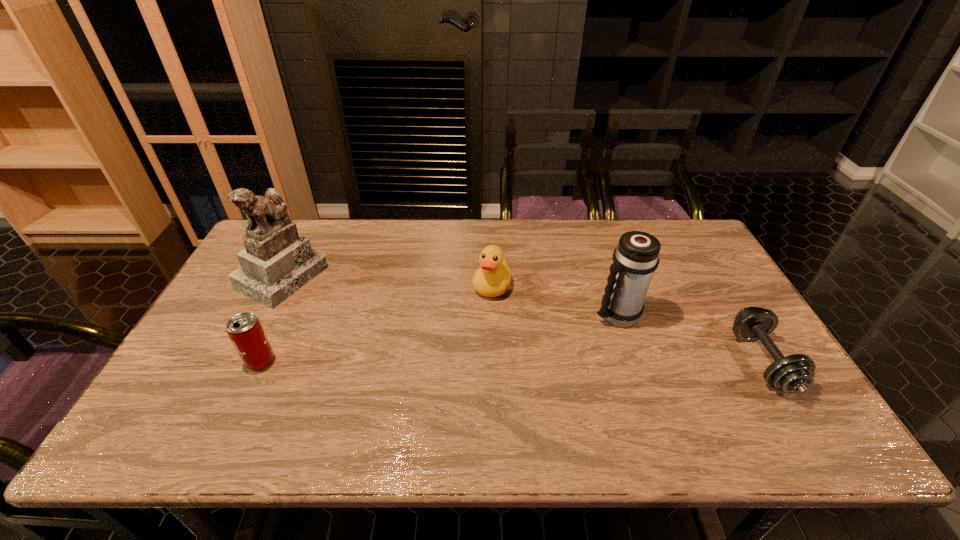
Identify the location of vacant space on the desktop that is between the beer can and the dumbbell and is positioned on the side with the handle of the fourth object from left to right. (559, 361).

Where is `vacant space on the desktop that is between the beer can and the dumbbell and is positioned on the front-facing side of the figurine`? The width and height of the screenshot is (960, 540). vacant space on the desktop that is between the beer can and the dumbbell and is positioned on the front-facing side of the figurine is located at coordinates (460, 361).

You are a GUI agent. You are given a task and a screenshot of the screen. Output one action in this format:
    pyautogui.click(x=<x>, y=<y>)
    Task: Click on the vacant spot on the desktop that is between the beer can and the rightmost object and is positioned at the beak of the duck
    The image size is (960, 540).
    Given the screenshot: What is the action you would take?
    pyautogui.click(x=458, y=361)